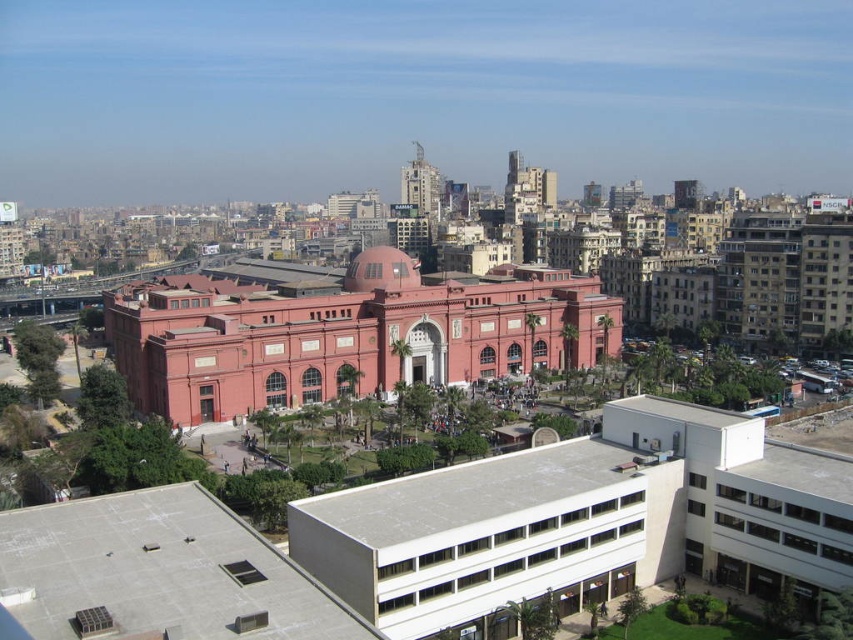
Between matte red building at center and matte red dome at center, which one appears on the right side from the viewer's perspective?

matte red dome at center is more to the right.

Does matte red building at center appear over matte red dome at center?

Incorrect, matte red building at center is not positioned above matte red dome at center.

Between point (453, 321) and point (347, 276), which one is positioned in front?

Point (453, 321) is more forward.

Where is `matte red building at center`? The height and width of the screenshot is (640, 853). matte red building at center is located at coordinates (345, 339).